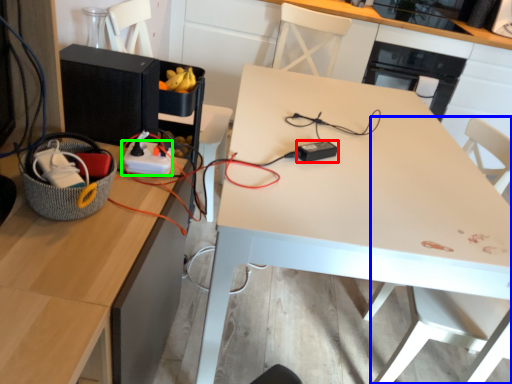
Question: Which object is the farthest from appliance (highlighted by a red box)? Choose among these: swivel chair (highlighted by a blue box) or extension cord (highlighted by a green box).

Choices:
 (A) swivel chair
 (B) extension cord

Answer: (A)